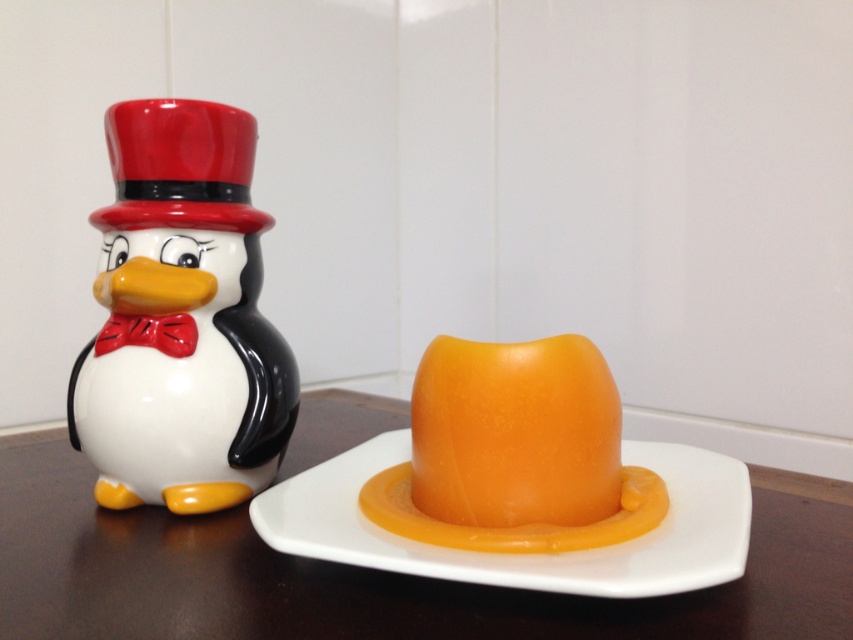
Question: Which point is farther to the camera?

Choices:
 (A) (704, 632)
 (B) (538, 536)
 (C) (178, 435)

Answer: (C)

Question: Can you confirm if glossy ceramic penguin at left is positioned to the left of matte red bow tie at left?

Choices:
 (A) yes
 (B) no

Answer: (B)

Question: Among these objects, which one is nearest to the camera?

Choices:
 (A) glossy ceramic penguin at left
 (B) matte white plate at center
 (C) orange glossy hat at center

Answer: (B)

Question: Considering the real-world distances, which object is closest to the glossy wooden table at center?

Choices:
 (A) glossy ceramic penguin at left
 (B) matte white plate at center
 (C) orange glossy hat at center

Answer: (B)

Question: Is glossy wooden table at center smaller than matte red bow tie at left?

Choices:
 (A) yes
 (B) no

Answer: (B)

Question: Is glossy ceramic penguin at left to the right of matte white plate at center from the viewer's perspective?

Choices:
 (A) yes
 (B) no

Answer: (B)